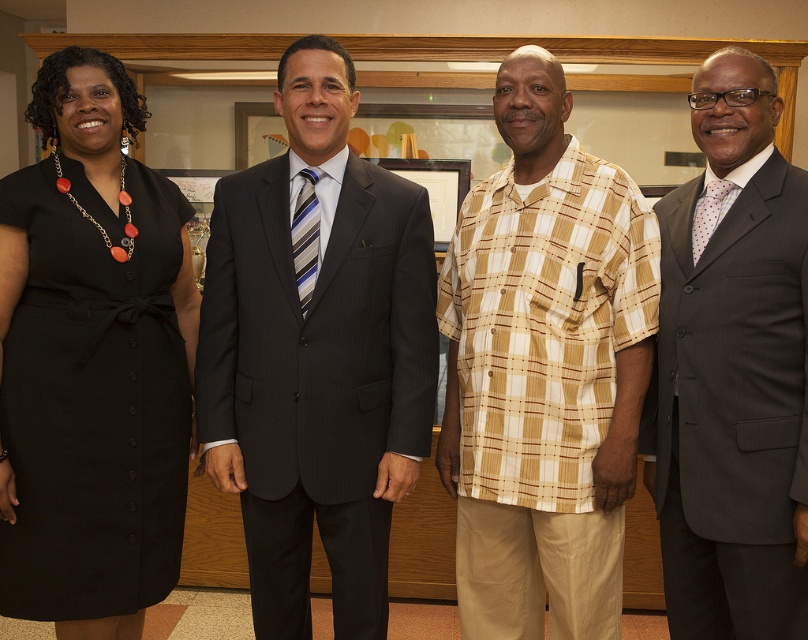
Is point (318, 166) farther from viewer compared to point (99, 380)?

That is True.

Is dark gray pinstripe suit at center in front of black fabric dress at left?

No, it is behind black fabric dress at left.

Does point (404, 484) come behind point (65, 60)?

That is True.

You are a GUI agent. You are given a task and a screenshot of the screen. Output one action in this format:
    pyautogui.click(x=<x>, y=<y>)
    Task: Click on the dark gray pinstripe suit at center
    The width and height of the screenshot is (808, 640).
    Given the screenshot: What is the action you would take?
    pyautogui.click(x=318, y=356)

Find the location of a particular element. This screenshot has height=640, width=808. gray suit at right is located at coordinates (731, 376).

Which is in front, point (739, 600) or point (303, 273)?

Point (739, 600)

Identify the location of gray suit at right. This screenshot has height=640, width=808. (731, 376).

Does beige plaid shirt at center come in front of polka dot silk tie at right?

No, beige plaid shirt at center is behind polka dot silk tie at right.

Who is shorter, beige plaid shirt at center or polka dot silk tie at right?

polka dot silk tie at right is shorter.

Which is in front, point (524, 403) or point (727, 195)?

Point (727, 195) is more forward.

The width and height of the screenshot is (808, 640). In order to click on beige plaid shirt at center in this screenshot , I will do `click(545, 369)`.